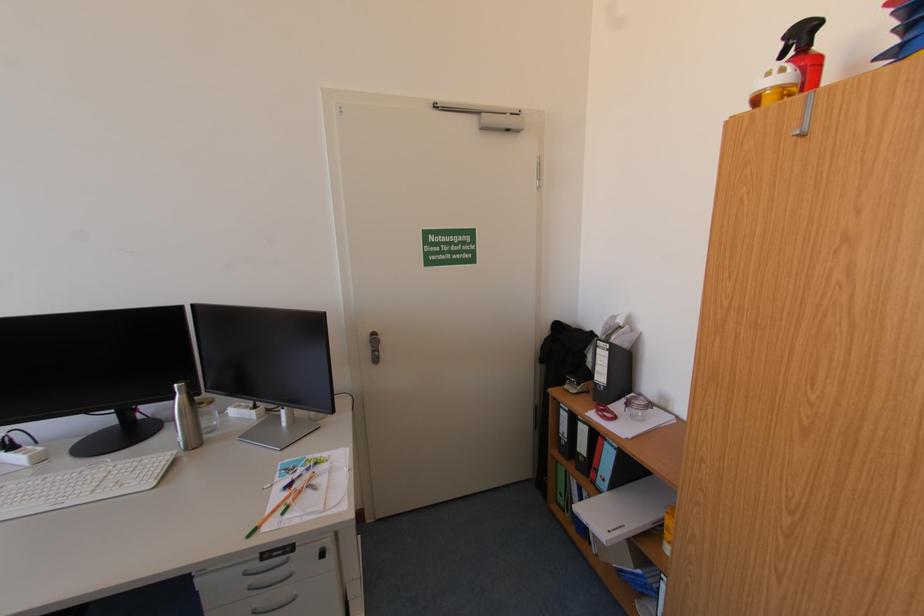
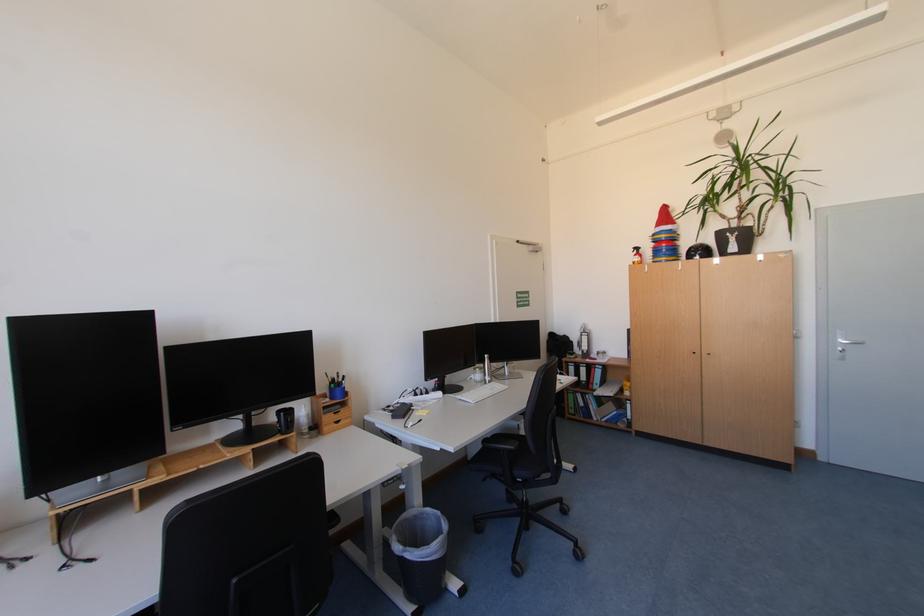
Where in the second image is the point corresponding to pixel 608 440 from the first image?

(601, 370)